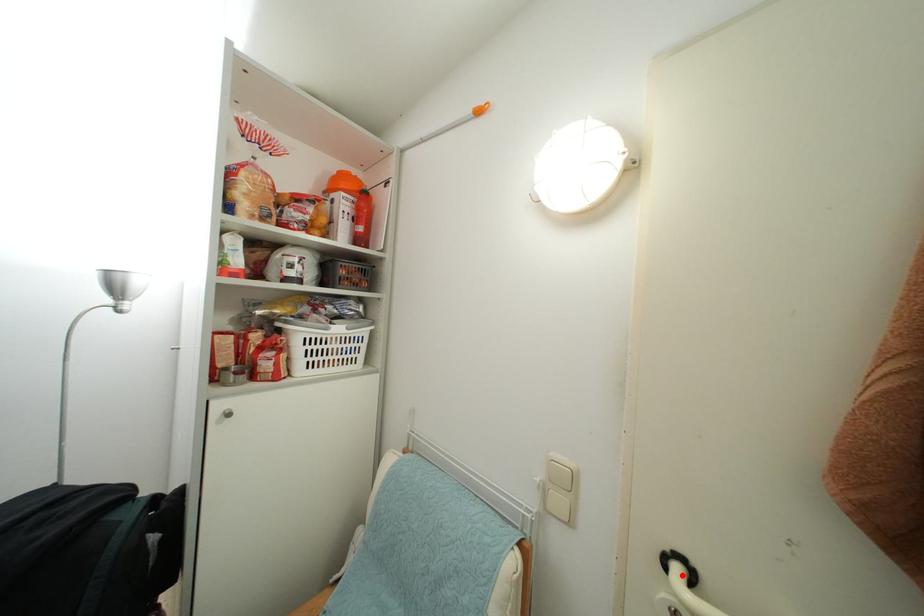
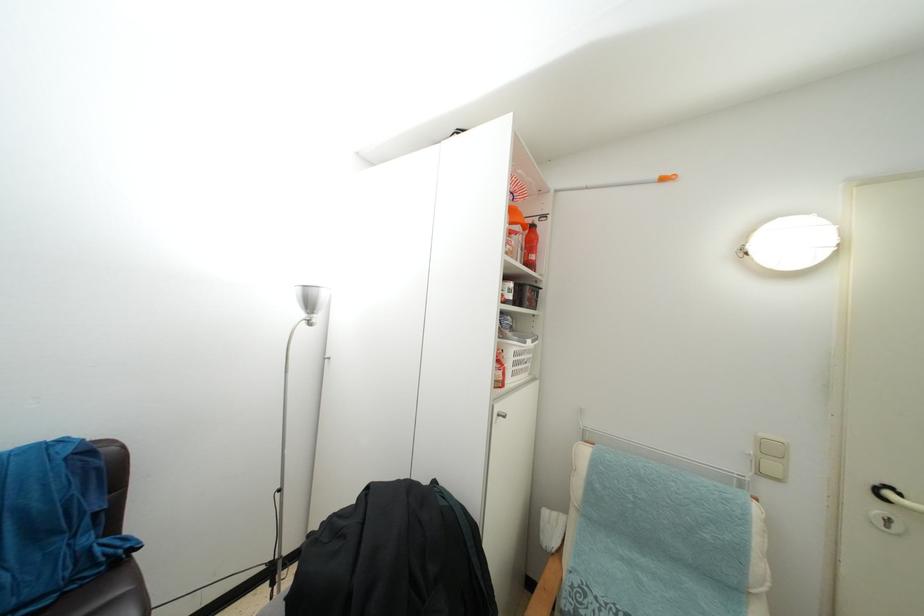
Where in the second image is the point corresponding to the highlighted location from the first image?

(893, 500)